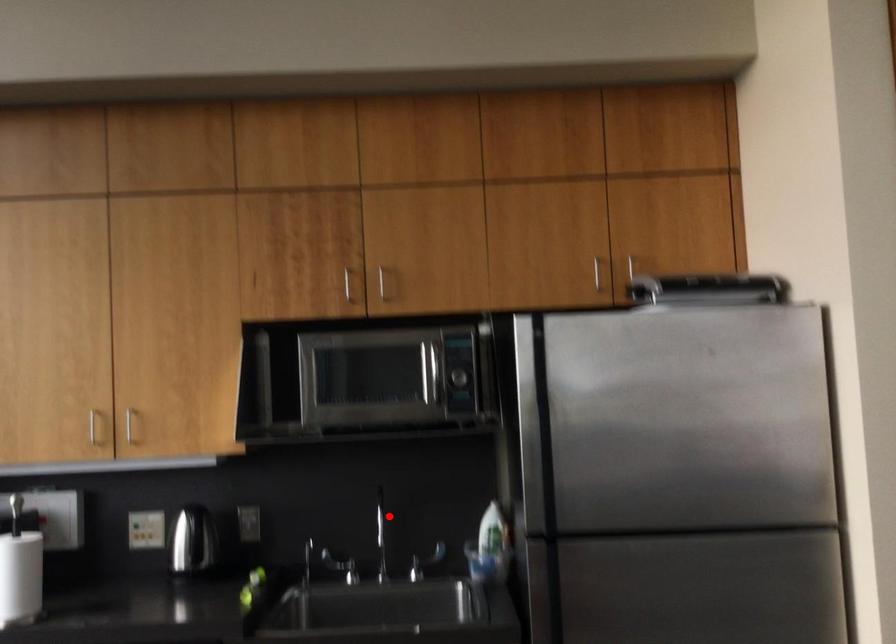
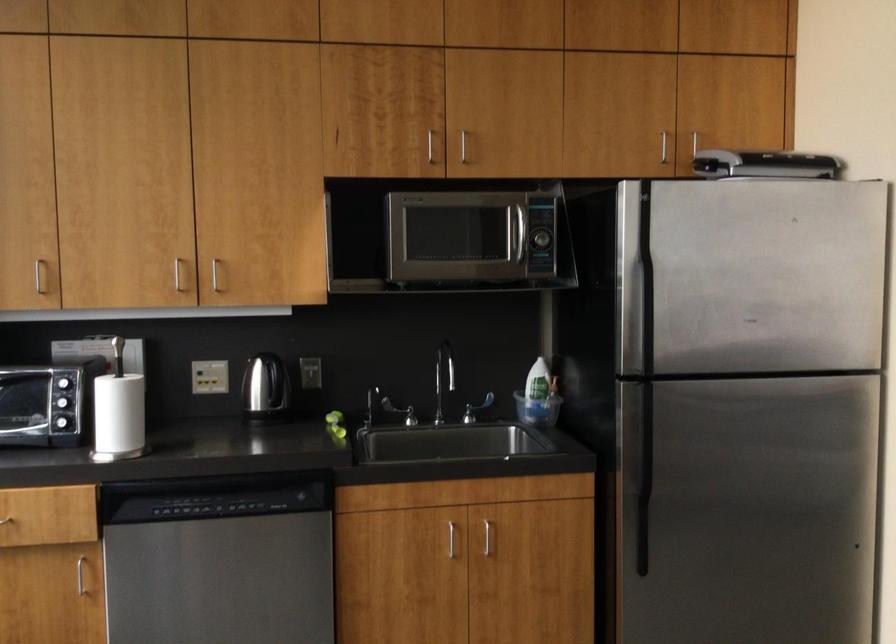
Locate, in the second image, the point that corresponds to the highlighted location in the first image.

(444, 371)